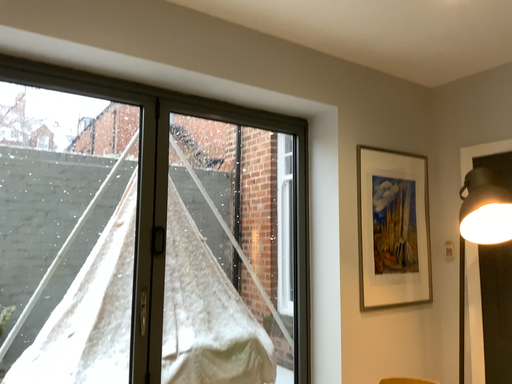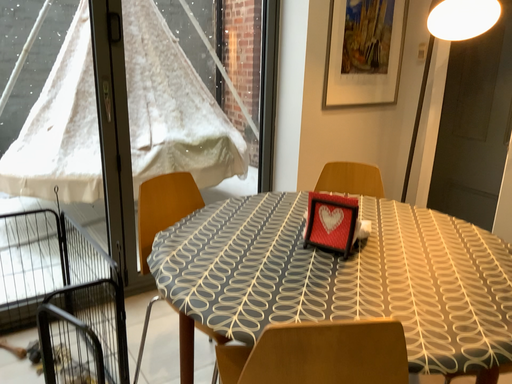
Question: How did the camera likely rotate when shooting the video?

Choices:
 (A) rotated upward
 (B) rotated downward

Answer: (B)